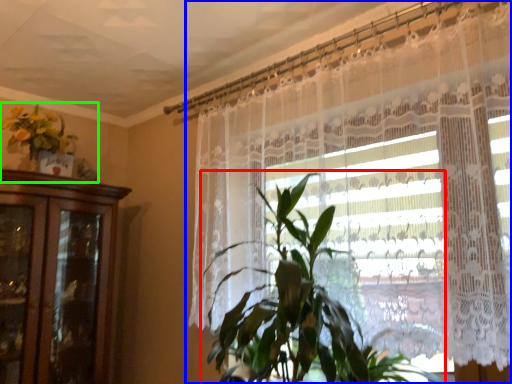
Question: Which object is positioned farthest from houseplant (highlighted by a red box)? Select from curtain (highlighted by a blue box) and floral arrangement (highlighted by a green box).

Choices:
 (A) curtain
 (B) floral arrangement

Answer: (B)